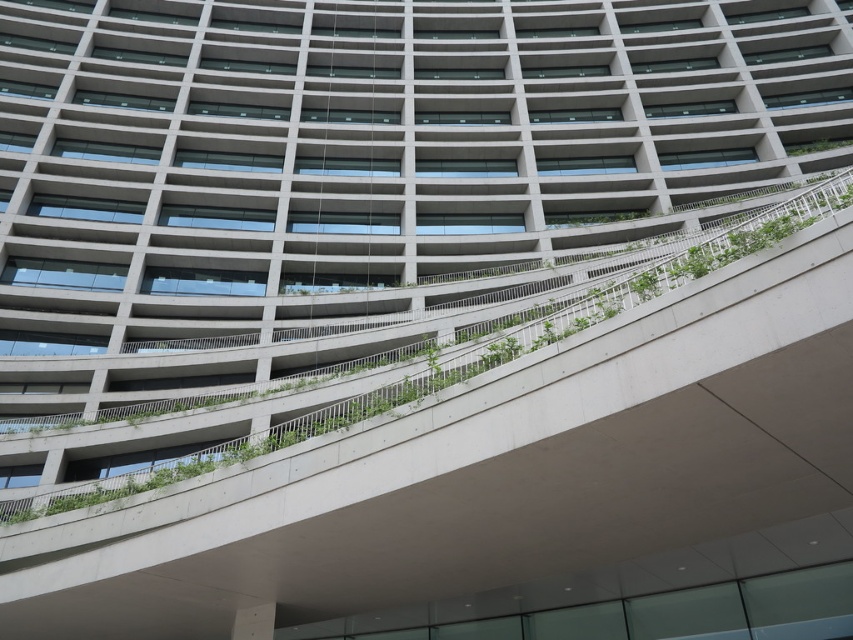
You are standing at the base of the building and want to water both the green leafy plant at center and the green leafy plant at upper right. If your watering can has a range of 25 meters, can you reach both plants from your current position?

The green leafy plant at center is 25.38 meters from the green leafy plant at upper right. Since your watering can only has a range of 25 meters, you cannot reach both plants from your current position as the distance between them exceeds the watering can range.